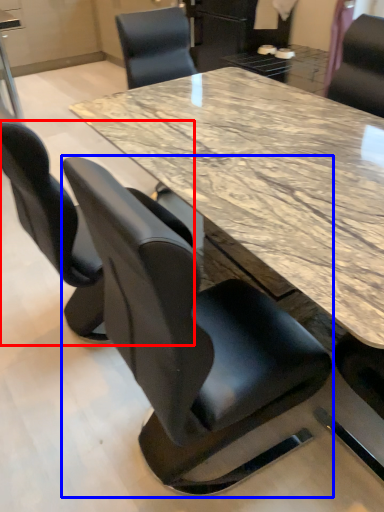
Question: Which object appears closest to the camera in this image, chair (highlighted by a red box) or chair (highlighted by a blue box)?

Choices:
 (A) chair
 (B) chair

Answer: (B)